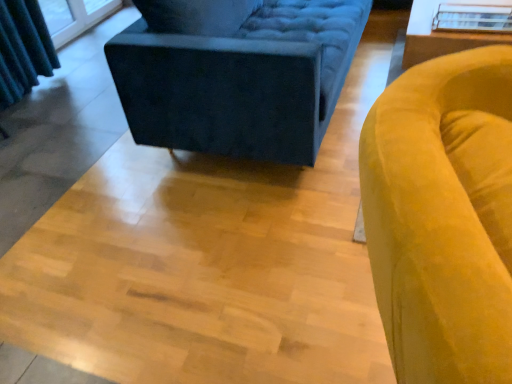
Find the location of `transparent glass table at upper right`. transparent glass table at upper right is located at coordinates (473, 18).

Measure the distance between point (207, 50) and camera.

The depth of point (207, 50) is 1.70 meters.

Where is `velvet yellow armchair at right`? This screenshot has height=384, width=512. velvet yellow armchair at right is located at coordinates (440, 218).

Is velvet dark blue studio couch at upper center facing away from transparent glass table at upper right?

Correct, velvet dark blue studio couch at upper center is looking away from transparent glass table at upper right.

Can you confirm if velvet dark blue studio couch at upper center is positioned to the right of transparent glass table at upper right?

No.

At what (x,y) coordinates should I click in order to perform the action: click on studio couch on the left of transparent glass table at upper right. Please return your answer as a coordinate pair (x, y). Looking at the image, I should click on (241, 81).

Between velvet dark blue studio couch at upper center and transparent glass table at upper right, which one has more height?

With more height is velvet dark blue studio couch at upper center.

Which object is thinner, velvet dark blue studio couch at upper center or velvet yellow armchair at right?

With smaller width is velvet yellow armchair at right.

Considering the relative sizes of velvet dark blue studio couch at upper center and velvet yellow armchair at right in the image provided, is velvet dark blue studio couch at upper center bigger than velvet yellow armchair at right?

Indeed, velvet dark blue studio couch at upper center has a larger size compared to velvet yellow armchair at right.

From the image's perspective, between velvet dark blue studio couch at upper center and velvet yellow armchair at right, who is located below?

velvet yellow armchair at right appears lower in the image.

Are velvet dark blue studio couch at upper center and velvet yellow armchair at right making contact?

No, velvet dark blue studio couch at upper center is not making contact with velvet yellow armchair at right.

Is transparent glass table at upper right not within velvet yellow armchair at right?

transparent glass table at upper right lies outside velvet yellow armchair at right's area.

Is transparent glass table at upper right facing away from velvet yellow armchair at right?

No, velvet yellow armchair at right is not at the back of transparent glass table at upper right.

Considering the relative positions of transparent glass table at upper right and velvet yellow armchair at right in the image provided, is transparent glass table at upper right to the left or to the right of velvet yellow armchair at right?

transparent glass table at upper right is positioned on velvet yellow armchair at right's right side.

Consider the image. Is transparent glass table at upper right taller than white glossy table at upper right?

No, transparent glass table at upper right is not taller than white glossy table at upper right.

What are the coordinates of `table that is under the transparent glass table at upper right (from a real-world perspective)` in the screenshot? It's located at (443, 33).

Which point is more distant from viewer, (458,12) or (454,0)?

The point (454,0) is farther from the camera.

Is white glossy table at upper right aimed at velvet dark blue studio couch at upper center?

No, white glossy table at upper right is not facing towards velvet dark blue studio couch at upper center.

Considering the sizes of white glossy table at upper right and velvet dark blue studio couch at upper center in the image, is white glossy table at upper right taller or shorter than velvet dark blue studio couch at upper center?

Considering their sizes, white glossy table at upper right has less height than velvet dark blue studio couch at upper center.

From a real-world perspective, who is located lower, white glossy table at upper right or velvet dark blue studio couch at upper center?

white glossy table at upper right.

In terms of height, does transparent glass table at upper right look taller or shorter compared to velvet dark blue studio couch at upper center?

transparent glass table at upper right is shorter than velvet dark blue studio couch at upper center.

Is transparent glass table at upper right far away from velvet dark blue studio couch at upper center?

That's not correct — transparent glass table at upper right is a little close to velvet dark blue studio couch at upper center.

At what (x,y) coordinates should I click in order to perform the action: click on studio couch in front of the transparent glass table at upper right. Please return your answer as a coordinate pair (x, y). Looking at the image, I should click on (241, 81).

Can we say velvet yellow armchair at right lies outside white glossy table at upper right?

Indeed, velvet yellow armchair at right is completely outside white glossy table at upper right.

Who is smaller, velvet yellow armchair at right or white glossy table at upper right?

With smaller size is white glossy table at upper right.

From a real-world perspective, is velvet yellow armchair at right under white glossy table at upper right?

No, from a real-world perspective, velvet yellow armchair at right is not beneath white glossy table at upper right.

From the picture: Is velvet yellow armchair at right positioned far away from white glossy table at upper right?

Yes, velvet yellow armchair at right is far from white glossy table at upper right.

Locate an element on the screen. This screenshot has height=384, width=512. studio couch above the transparent glass table at upper right (from the image's perspective) is located at coordinates (241, 81).

In order to click on chair located in front of the velvet dark blue studio couch at upper center in this screenshot , I will do `click(440, 218)`.

In the scene shown: From the image, which object appears to be nearer to velvet dark blue studio couch at upper center, transparent glass table at upper right or white glossy table at upper right?

white glossy table at upper right lies closer to velvet dark blue studio couch at upper center than the other object.

Which object lies nearer to the anchor point white glossy table at upper right, velvet dark blue studio couch at upper center or transparent glass table at upper right?

Based on the image, transparent glass table at upper right appears to be nearer to white glossy table at upper right.

From the image, which object appears to be nearer to transparent glass table at upper right, velvet yellow armchair at right or velvet dark blue studio couch at upper center?

velvet dark blue studio couch at upper center.

Based on their spatial positions, is white glossy table at upper right or velvet dark blue studio couch at upper center further from transparent glass table at upper right?

velvet dark blue studio couch at upper center lies further to transparent glass table at upper right than the other object.

From the picture: Which object lies nearer to the anchor point velvet yellow armchair at right, transparent glass table at upper right or velvet dark blue studio couch at upper center?

velvet dark blue studio couch at upper center is positioned closer to the anchor velvet yellow armchair at right.

Which object lies nearer to the anchor point transparent glass table at upper right, velvet dark blue studio couch at upper center or white glossy table at upper right?

white glossy table at upper right lies closer to transparent glass table at upper right than the other object.

When comparing their distances from velvet yellow armchair at right, does transparent glass table at upper right or white glossy table at upper right seem closer?

Based on the image, white glossy table at upper right appears to be nearer to velvet yellow armchair at right.

Looking at the image, which one is located closer to velvet dark blue studio couch at upper center, transparent glass table at upper right or velvet yellow armchair at right?

transparent glass table at upper right.

What are the coordinates of `studio couch between velvet yellow armchair at right and white glossy table at upper right along the z-axis` in the screenshot? It's located at (241, 81).

What are the coordinates of `studio couch between velvet yellow armchair at right and transparent glass table at upper right along the z-axis` in the screenshot? It's located at (241, 81).

The width and height of the screenshot is (512, 384). Identify the location of glass table between velvet dark blue studio couch at upper center and white glossy table at upper right in the horizontal direction. (473, 18).

I want to click on table between velvet yellow armchair at right and transparent glass table at upper right from front to back, so click(x=443, y=33).